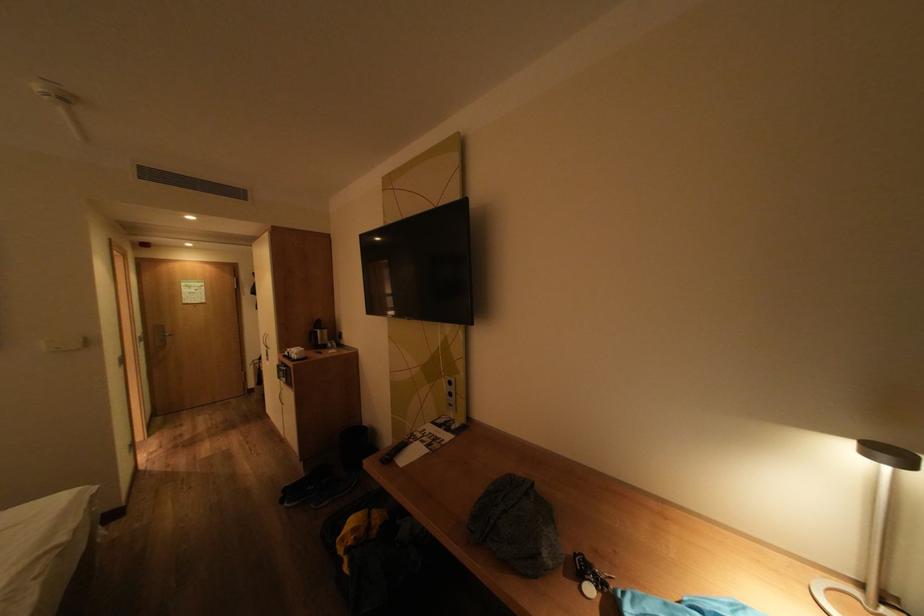
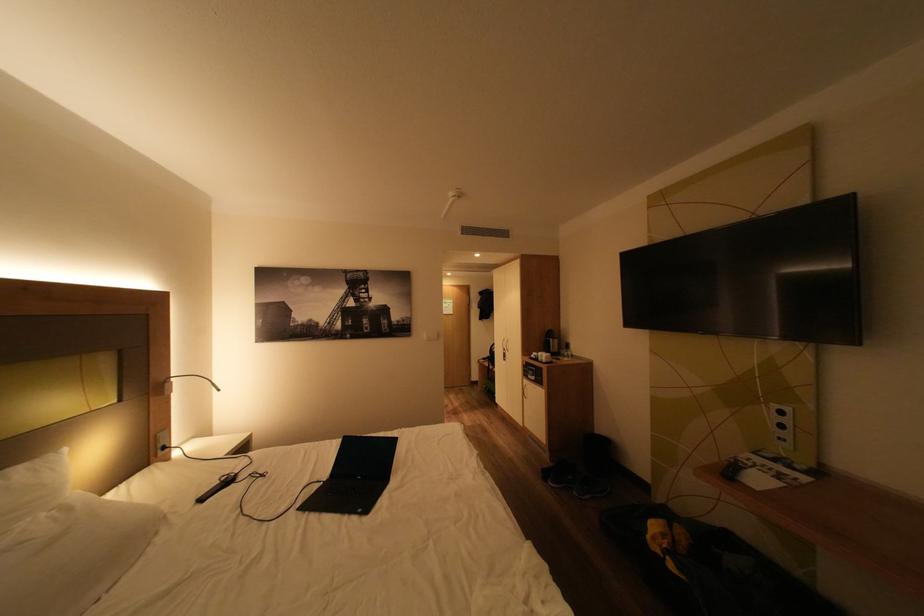
Question: Based on the continuous images, in which direction is the camera rotating? Reply with the corresponding letter.

Choices:
 (A) Left
 (B) Right
 (C) Up
 (D) Down

Answer: (A)